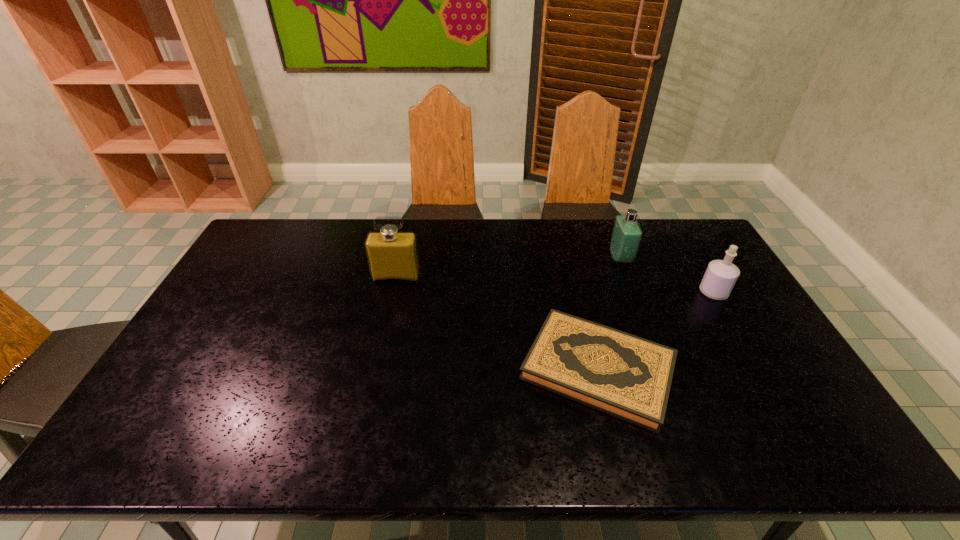
At what (x,y) coordinates should I click in order to perform the action: click on the leftmost object. Please return your answer as a coordinate pair (x, y). The width and height of the screenshot is (960, 540). Looking at the image, I should click on (392, 255).

Locate an element on the screen. Image resolution: width=960 pixels, height=540 pixels. the farthest perfume is located at coordinates (626, 236).

Locate an element on the screen. The width and height of the screenshot is (960, 540). the farthest object is located at coordinates (626, 236).

Find the location of a particular element. This screenshot has width=960, height=540. the rightmost object is located at coordinates (720, 277).

Image resolution: width=960 pixels, height=540 pixels. What are the coordinates of `the nearest object` in the screenshot? It's located at (628, 377).

Where is `the shortest object`? The width and height of the screenshot is (960, 540). the shortest object is located at coordinates (628, 377).

At what (x,y) coordinates should I click in order to perform the action: click on vacant space situated 0.380m on the front-facing side of the leftmost object. Please return your answer as a coordinate pair (x, y). The width and height of the screenshot is (960, 540). Looking at the image, I should click on (373, 380).

Where is `vacant area situated on the front label of the farthest perfume`? The width and height of the screenshot is (960, 540). vacant area situated on the front label of the farthest perfume is located at coordinates (539, 258).

Locate an element on the screen. vacant region located 0.200m on the front label of the farthest perfume is located at coordinates point(553,258).

Locate an element on the screen. vacant region located 0.220m on the front label of the farthest perfume is located at coordinates (547, 258).